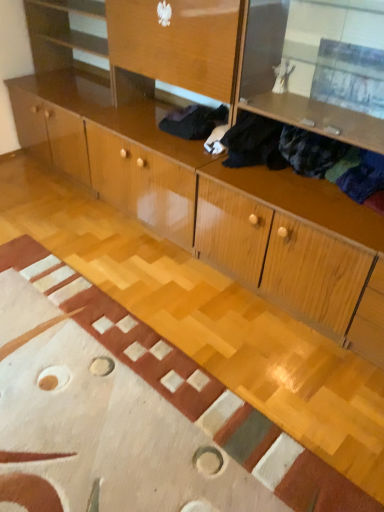
Question: Can you see dark blue fabric at upper right, positioned as the 2th clothing in back-to-front order, touching black fabric at center, the 2th clothing viewed from the front?

Choices:
 (A) yes
 (B) no

Answer: (B)

Question: Considering the relative sizes of dark blue fabric at upper right, positioned as the 1th clothing in front-to-back order, and black fabric at center, the 2th clothing viewed from the front, in the image provided, is dark blue fabric at upper right, positioned as the 1th clothing in front-to-back order, smaller than black fabric at center, the 2th clothing viewed from the front,?

Choices:
 (A) yes
 (B) no

Answer: (B)

Question: Can you confirm if dark blue fabric at upper right, positioned as the 1th clothing in front-to-back order, is positioned to the left of black fabric at center, the first clothing positioned from the back?

Choices:
 (A) no
 (B) yes

Answer: (A)

Question: Is black fabric at center, the 2th clothing viewed from the front, at the back of dark blue fabric at upper right, positioned as the 2th clothing in back-to-front order?

Choices:
 (A) no
 (B) yes

Answer: (A)

Question: Is the position of dark blue fabric at upper right, positioned as the 2th clothing in back-to-front order, more distant than that of black fabric at center, the 2th clothing viewed from the front?

Choices:
 (A) no
 (B) yes

Answer: (A)

Question: Is dark blue fabric at upper right, positioned as the 1th clothing in front-to-back order, positioned before black fabric at center, the first clothing positioned from the back?

Choices:
 (A) yes
 (B) no

Answer: (A)

Question: Is black fabric at center, the first clothing positioned from the back, thinner than dark blue fabric at upper right, positioned as the 2th clothing in back-to-front order?

Choices:
 (A) no
 (B) yes

Answer: (A)

Question: Is there a large distance between black fabric at center, the first clothing positioned from the back, and dark blue fabric at upper right, positioned as the 2th clothing in back-to-front order?

Choices:
 (A) no
 (B) yes

Answer: (A)

Question: Considering the relative positions of black fabric at center, the first clothing positioned from the back, and dark blue fabric at upper right, positioned as the 1th clothing in front-to-back order, in the image provided, is black fabric at center, the first clothing positioned from the back, to the left of dark blue fabric at upper right, positioned as the 1th clothing in front-to-back order, from the viewer's perspective?

Choices:
 (A) no
 (B) yes

Answer: (B)

Question: Can you confirm if black fabric at center, the 2th clothing viewed from the front, is positioned to the right of dark blue fabric at upper right, positioned as the 1th clothing in front-to-back order?

Choices:
 (A) yes
 (B) no

Answer: (B)

Question: Is black fabric at center, the 2th clothing viewed from the front, in front of dark blue fabric at upper right, positioned as the 1th clothing in front-to-back order?

Choices:
 (A) no
 (B) yes

Answer: (A)

Question: Is black fabric at center, the first clothing positioned from the back, facing towards dark blue fabric at upper right, positioned as the 2th clothing in back-to-front order?

Choices:
 (A) no
 (B) yes

Answer: (A)

Question: Considering the positions of black fabric at center, the first clothing positioned from the back, and dark blue fabric at upper right, positioned as the 2th clothing in back-to-front order, in the image, is black fabric at center, the first clothing positioned from the back, taller or shorter than dark blue fabric at upper right, positioned as the 2th clothing in back-to-front order,?

Choices:
 (A) tall
 (B) short

Answer: (B)